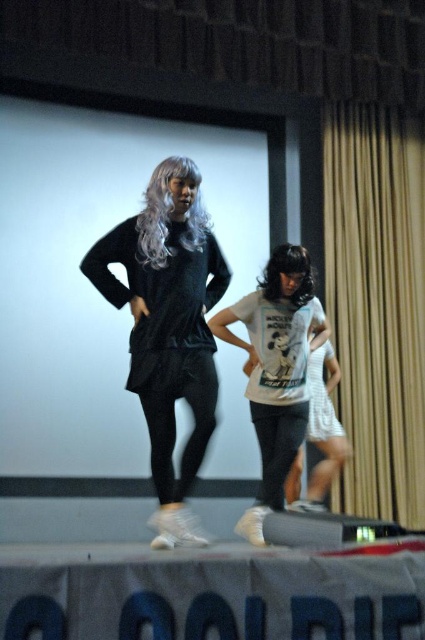
Is matte black dress at center thinner than dark brown silky hair at center?

In fact, matte black dress at center might be wider than dark brown silky hair at center.

Is point (189, 218) behind point (294, 292)?

No, it is in front of (294, 292).

Where is `matte black dress at center`? matte black dress at center is located at coordinates (167, 326).

Which of these two, matte black dress at center or white matte shirt at center, stands taller?

With more height is matte black dress at center.

Is point (207, 371) farther from viewer compared to point (331, 452)?

No, it is in front of (331, 452).

Where is `matte black dress at center`? matte black dress at center is located at coordinates (167, 326).

Which is below, matte gold curtain at right or white matte shirt at center?

Positioned lower is white matte shirt at center.

Does matte gold curtain at right appear under white matte shirt at center?

No, matte gold curtain at right is not below white matte shirt at center.

I want to click on matte gold curtain at right, so click(x=377, y=304).

This screenshot has width=425, height=640. In order to click on matte gold curtain at right in this screenshot , I will do `click(377, 304)`.